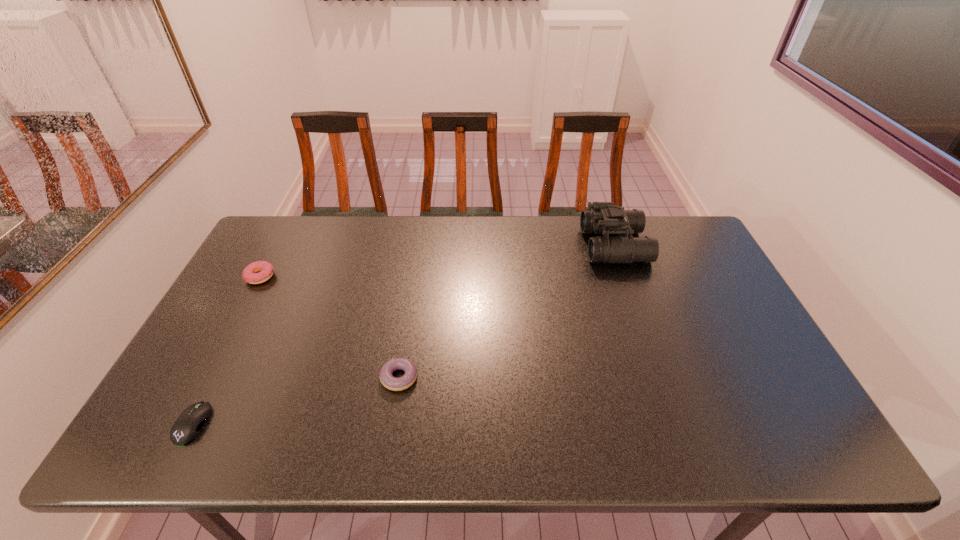
Where is `the tallest object`? the tallest object is located at coordinates click(x=605, y=218).

Locate an element on the screen. Image resolution: width=960 pixels, height=540 pixels. the rightmost object is located at coordinates (x=605, y=218).

Find the location of a particular element. the farther doughnut is located at coordinates 265,270.

Image resolution: width=960 pixels, height=540 pixels. I want to click on the second object from right to left, so click(387, 379).

What are the coordinates of `the right doughnut` in the screenshot? It's located at (387, 379).

In order to click on the nearest object in this screenshot , I will do `click(187, 426)`.

Where is `vacant region located through the lenses of the rightmost object`? The height and width of the screenshot is (540, 960). vacant region located through the lenses of the rightmost object is located at coordinates (561, 245).

Image resolution: width=960 pixels, height=540 pixels. Find the location of `vacant area situated 0.240m through the lenses of the rightmost object`. vacant area situated 0.240m through the lenses of the rightmost object is located at coordinates (514, 245).

Where is `free region located 0.310m through the lenses of the rightmost object`? free region located 0.310m through the lenses of the rightmost object is located at coordinates (493, 245).

At what (x,y) coordinates should I click in order to perform the action: click on free location located 0.050m on the front of the left doughnut. Please return your answer as a coordinate pair (x, y). This screenshot has height=540, width=960. Looking at the image, I should click on (248, 299).